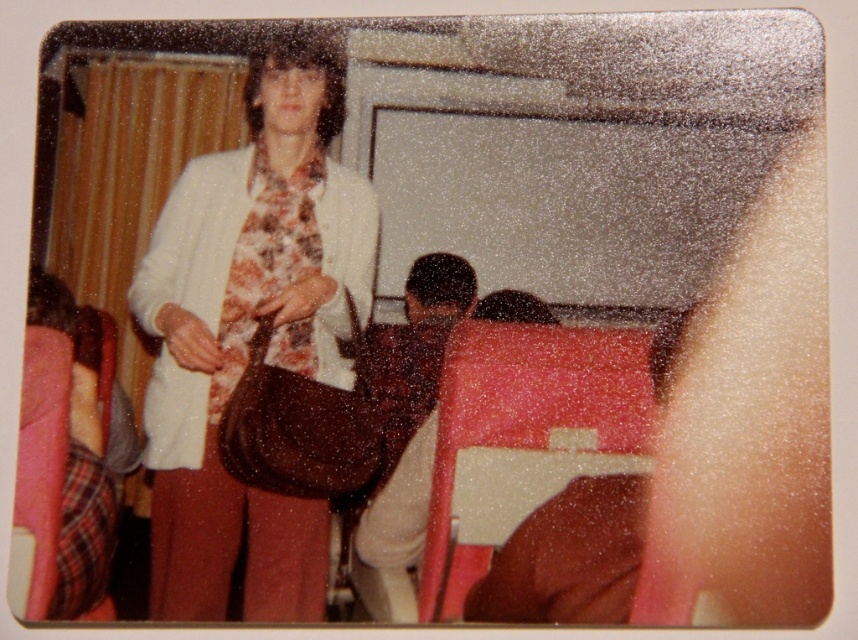
You are organizing a small event and need to place a decorative item on a table. The table has limited space, and you have both the smooth brown leather bag at lower right and the floral fabric tie at center. Which object would you choose to fit better on the table if you want to maximize space?

The floral fabric tie at center would fit better on the table since it is smaller in width compared to the smooth brown leather bag at lower right.

You are an observer in the vintage classroom photo. You see the smooth brown leather bag at lower right and the floral fabric tie at center. Which object is positioned lower in the image?

The smooth brown leather bag at lower right is positioned lower than the floral fabric tie at center.